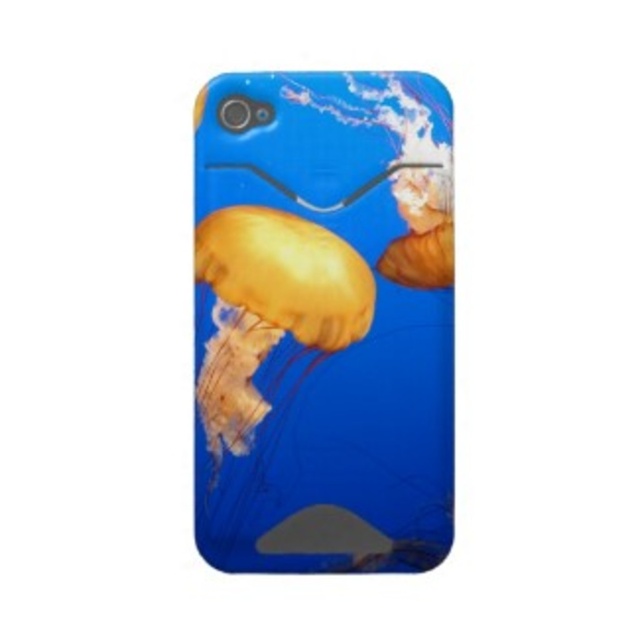
Question: Can you confirm if translucent plastic jellyfish case at center is positioned above translucent yellow jellyfish at center?

Choices:
 (A) yes
 (B) no

Answer: (A)

Question: Considering the relative positions of translucent plastic jellyfish case at center and translucent yellow jellyfish at center in the image provided, where is translucent plastic jellyfish case at center located with respect to translucent yellow jellyfish at center?

Choices:
 (A) right
 (B) left

Answer: (A)

Question: Among these points, which one is farthest from the camera?

Choices:
 (A) (212, 346)
 (B) (362, 296)

Answer: (B)

Question: Does translucent plastic jellyfish case at center appear under translucent yellow jellyfish at center?

Choices:
 (A) yes
 (B) no

Answer: (B)

Question: Among these objects, which one is nearest to the camera?

Choices:
 (A) translucent plastic jellyfish case at center
 (B) translucent yellow jellyfish at center

Answer: (A)